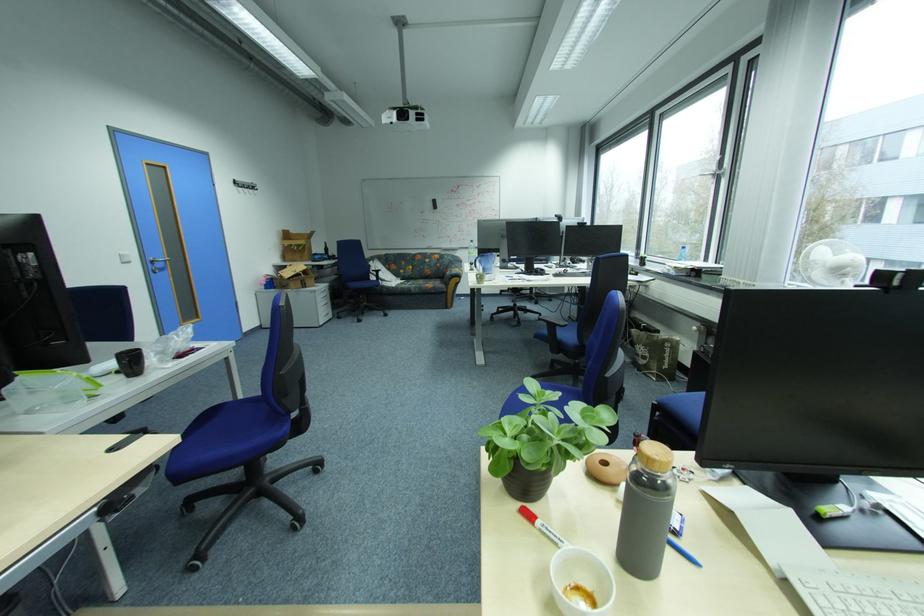
Find the location of `silver door handle`. silver door handle is located at coordinates (160, 262).